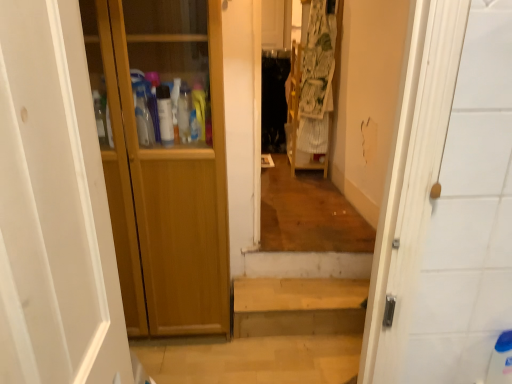
Identify the location of free space above wooden cabinet at left (from a real-world perspective). (237, 351).